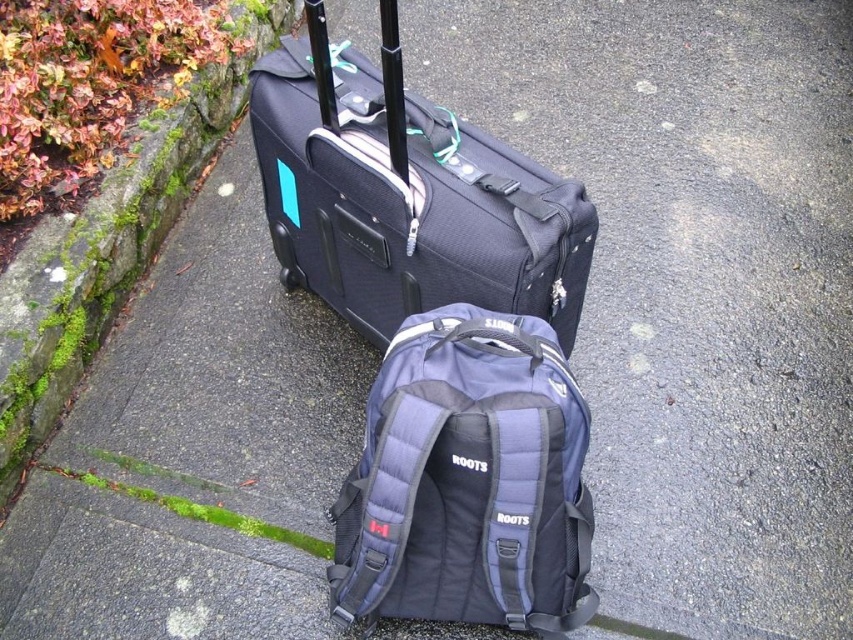
Question: Which object is positioned farthest from the matte black suitcase at center?

Choices:
 (A) green mossy stone at lower left
 (B) navy blue fabric backpack at center

Answer: (A)

Question: Which of these objects is positioned closest to the matte black suitcase at center?

Choices:
 (A) navy blue fabric backpack at center
 (B) green mossy stone at lower left

Answer: (A)

Question: Which of the following is the farthest from the observer?

Choices:
 (A) green mossy stone at lower left
 (B) navy blue fabric backpack at center
 (C) matte black suitcase at center

Answer: (A)

Question: Can you confirm if matte black suitcase at center is positioned below green mossy stone at lower left?

Choices:
 (A) yes
 (B) no

Answer: (A)

Question: Is navy blue fabric backpack at center bigger than green mossy stone at lower left?

Choices:
 (A) yes
 (B) no

Answer: (B)

Question: Is matte black suitcase at center below green mossy stone at lower left?

Choices:
 (A) no
 (B) yes

Answer: (B)